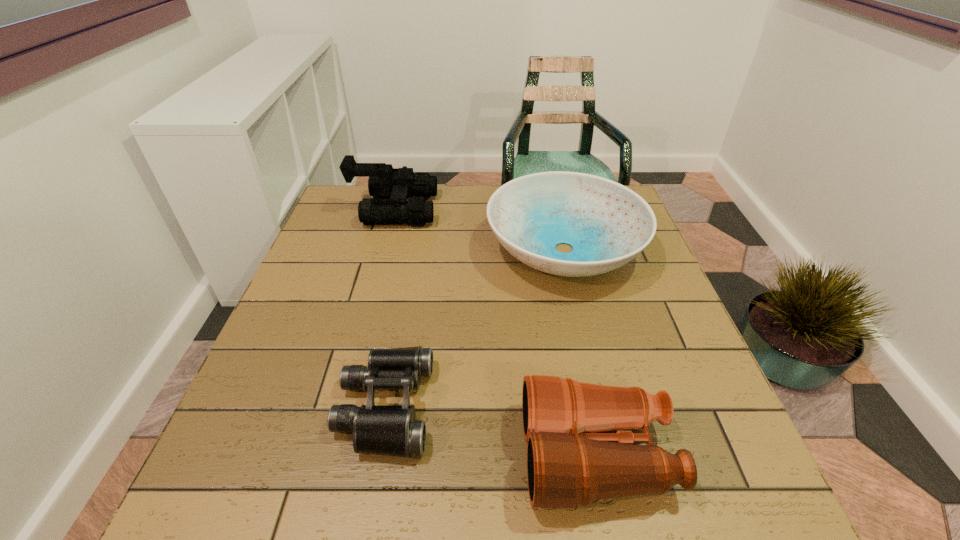
I want to click on the farthest binoculars, so coord(398,184).

At what (x,y) coordinates should I click in order to perform the action: click on the tallest binoculars. Please return your answer as a coordinate pair (x, y). Looking at the image, I should click on [x=398, y=184].

Where is `dish`? dish is located at coordinates (607, 224).

The height and width of the screenshot is (540, 960). I want to click on the second shortest binoculars, so click(568, 464).

Locate an element on the screen. This screenshot has height=540, width=960. the shortest object is located at coordinates (391, 430).

The height and width of the screenshot is (540, 960). What are the coordinates of `free region located on the front lenses of the tallest binoculars` in the screenshot? It's located at (455, 210).

Locate an element on the screen. This screenshot has height=540, width=960. free space located 0.110m on the back of the dish is located at coordinates (550, 189).

The height and width of the screenshot is (540, 960). What are the coordinates of `blank space located through the lenses of the rightmost binoculars` in the screenshot? It's located at (339, 455).

The height and width of the screenshot is (540, 960). In order to click on free region located 0.070m through the lenses of the rightmost binoculars in this screenshot , I will do `click(485, 455)`.

This screenshot has width=960, height=540. I want to click on free space located through the lenses of the rightmost binoculars, so click(322, 455).